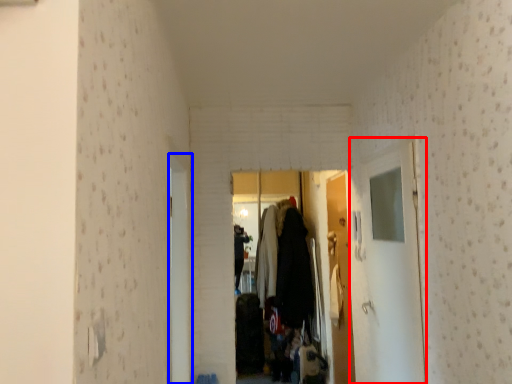
Question: Which of the following is the farthest to the observer, glass door (highlighted by a red box) or door (highlighted by a blue box)?

Choices:
 (A) glass door
 (B) door

Answer: (A)